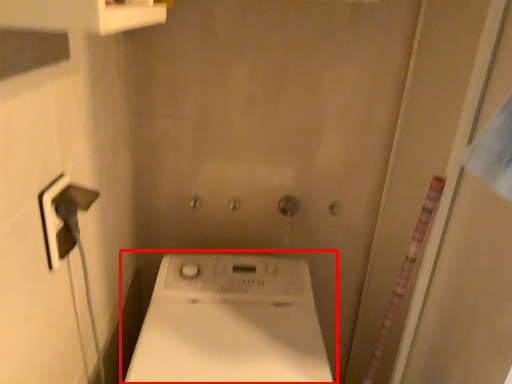
Question: From the image's perspective, what is the correct spatial positioning of washing machine (annotated by the red box) in reference to screen door?

Choices:
 (A) above
 (B) below

Answer: (B)